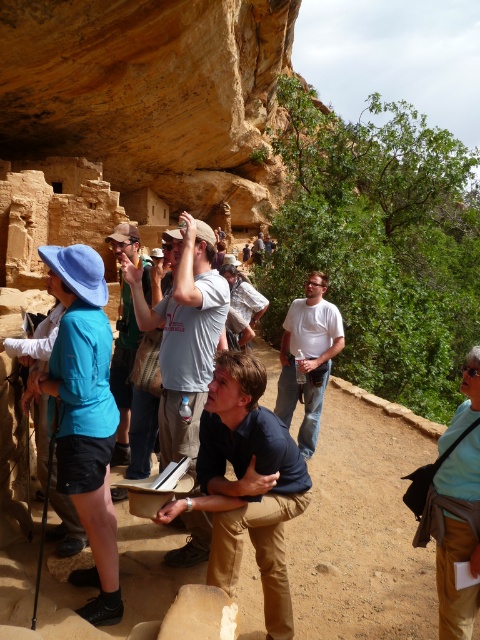
Question: Based on their relative distances, which object is nearer to the green fabric backpack at upper left?

Choices:
 (A) dark blue shirt at center
 (B) light blue fabric shirt at lower right
 (C) blue fabric hat at upper left

Answer: (C)

Question: Is dark blue shirt at center further to camera compared to green fabric backpack at upper left?

Choices:
 (A) yes
 (B) no

Answer: (B)

Question: Which is nearer to the green fabric backpack at upper left?

Choices:
 (A) dark blue shirt at center
 (B) light blue fabric shirt at lower right

Answer: (A)

Question: Observing the image, what is the correct spatial positioning of dark blue shirt at center in reference to light blue fabric shirt at lower right?

Choices:
 (A) right
 (B) left

Answer: (B)

Question: Is dark blue shirt at center above blue fabric hat at upper left?

Choices:
 (A) yes
 (B) no

Answer: (B)

Question: Which object appears farthest from the camera in this image?

Choices:
 (A) green fabric backpack at upper left
 (B) dark blue shirt at center
 (C) blue fabric hat at upper left

Answer: (A)